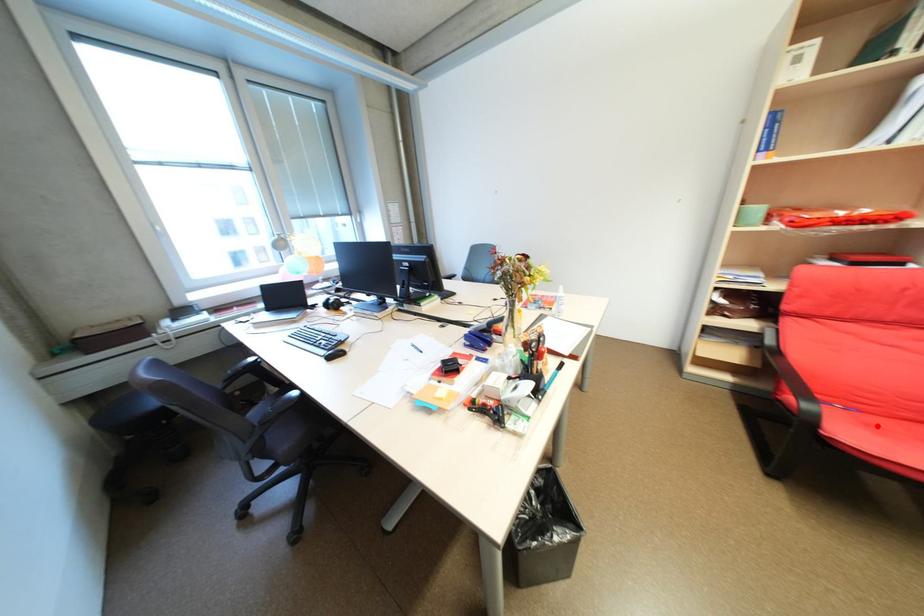
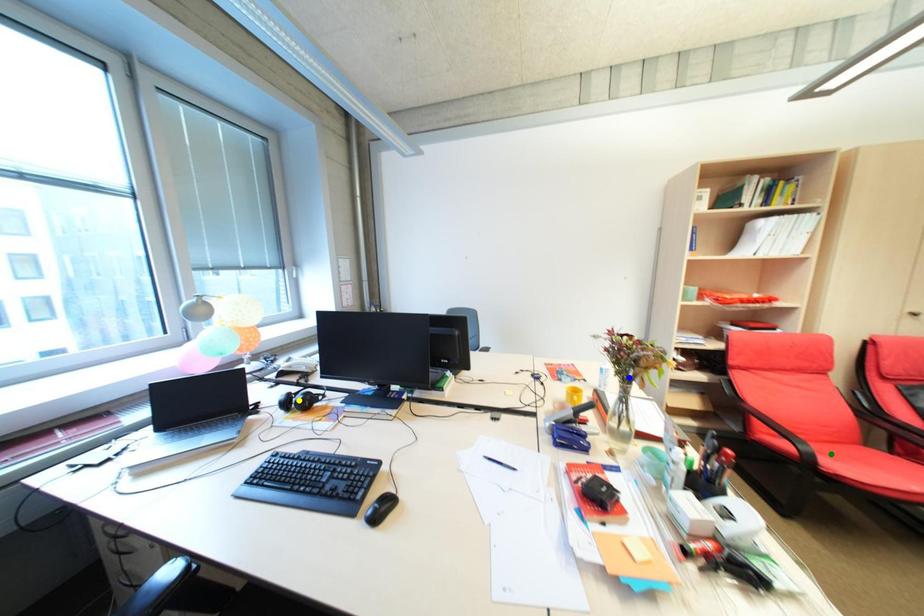
Question: I am providing you with two images of the same scene from different viewpoints. A red point is marked on the first image. You are given multiple points on the second image. Which point in image 2 represents the same 3d spot as the red point in image 1?

Choices:
 (A) blue point
 (B) yellow point
 (C) green point

Answer: (C)